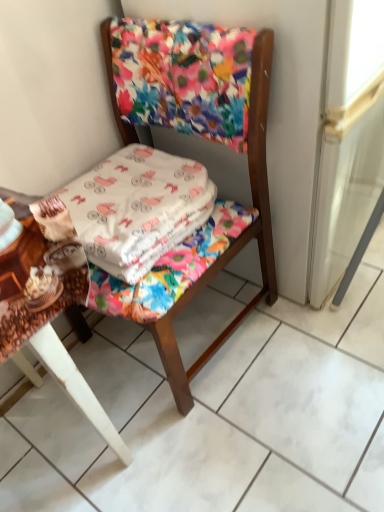
This screenshot has width=384, height=512. What are the coordinates of `free space between floral fabric chair at center and wooden table at lower left` in the screenshot? It's located at (193, 381).